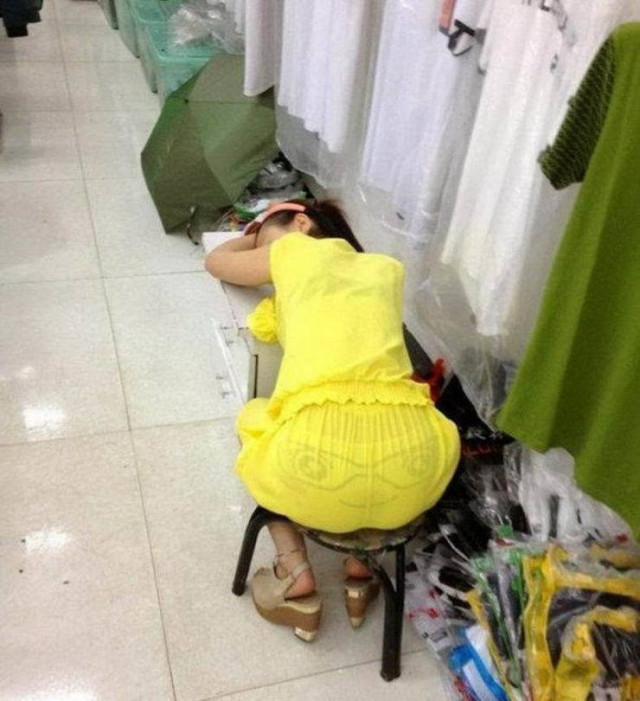
Identify the location of black chair leg. This screenshot has width=640, height=701. (390, 641), (243, 551).